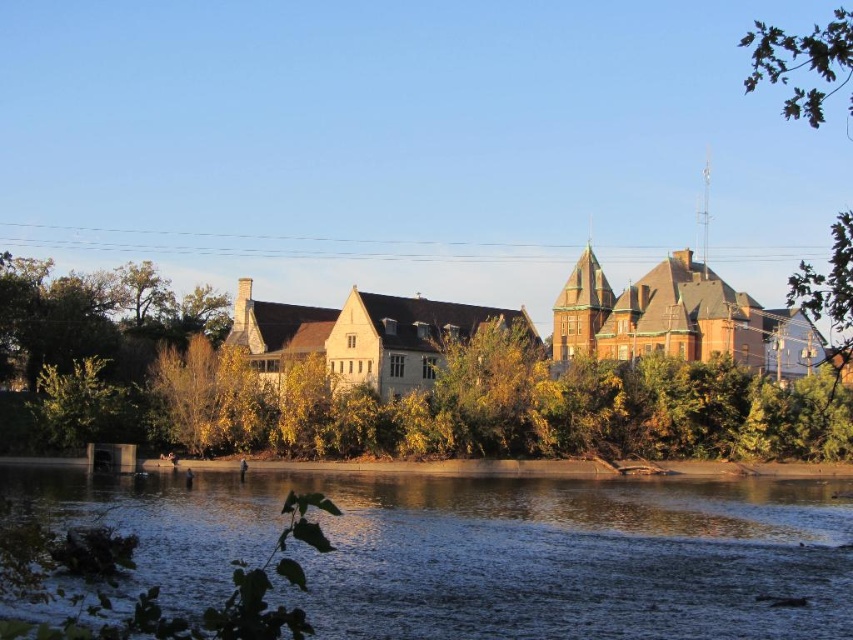
You are standing on the riverside path and want to take a photo of both the dark blue water at lower center and the green leafy tree at center. Which object should you position to your left side to include both in the frame?

To include both the dark blue water at lower center and the green leafy tree at center in your photo, position the green leafy tree at center to your left side since the dark blue water at lower center is located to the right of the green leafy tree at center.